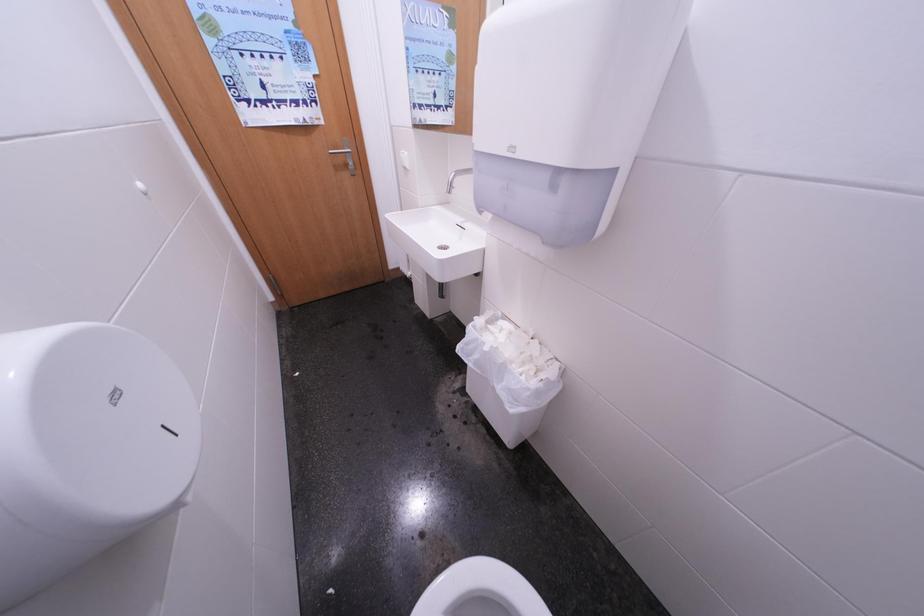
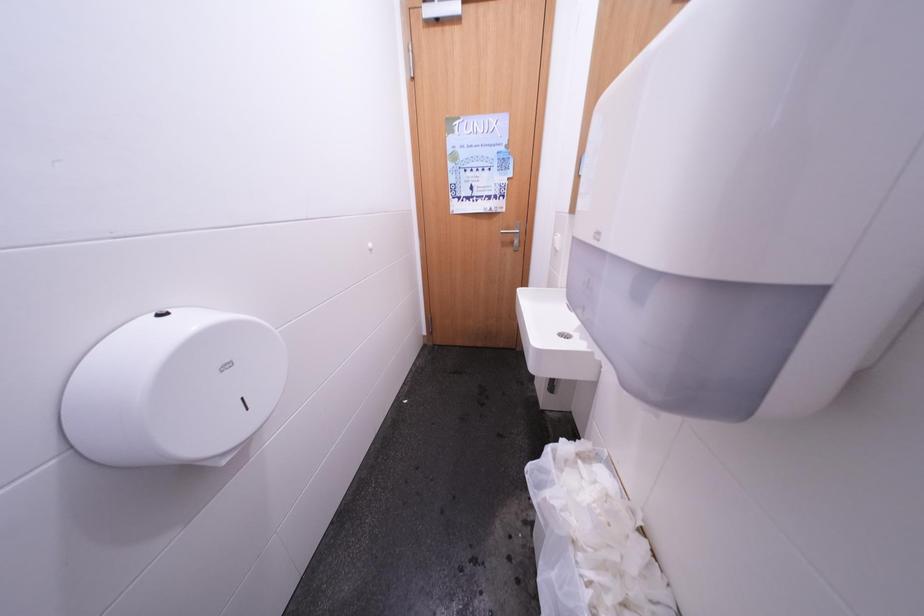
Question: How did the camera likely rotate?

Choices:
 (A) Left
 (B) Right
 (C) Up
 (D) Down

Answer: (A)